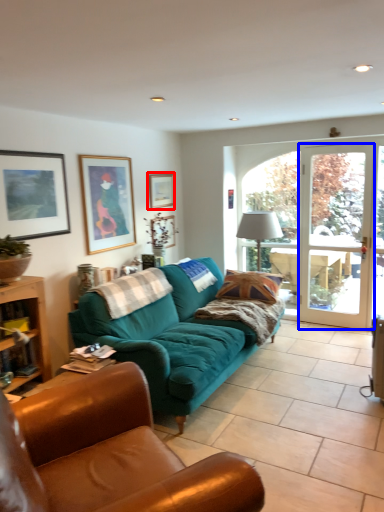
Question: Which object appears farthest to the camera in this image, picture frame (highlighted by a red box) or screen door (highlighted by a blue box)?

Choices:
 (A) picture frame
 (B) screen door

Answer: (A)